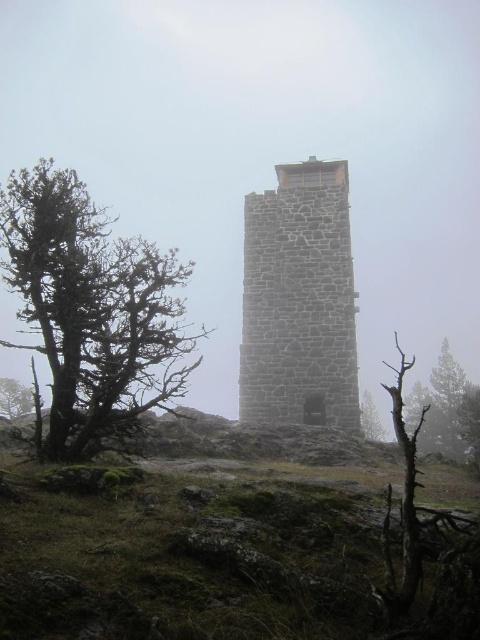
Locate an element on the screen. The height and width of the screenshot is (640, 480). stone tower at center is located at coordinates (300, 300).

Between point (264, 195) and point (15, 401), which one is positioned in front?

Positioned in front is point (264, 195).

Image resolution: width=480 pixels, height=640 pixels. I want to click on stone tower at center, so click(x=300, y=300).

Which is above, brown textured tree at lower right or green leafy tree at left?

brown textured tree at lower right

Is point (478, 400) farther from viewer compared to point (12, 401)?

No, (478, 400) is closer to viewer.

Is point (456, 401) closer to camera compared to point (20, 381)?

Yes.

Find the location of a particular element. Image resolution: width=480 pixels, height=640 pixels. brown textured tree at lower right is located at coordinates (446, 412).

Looking at this image, does green leafy tree at left appear under bare wood tree at center?

Incorrect, green leafy tree at left is not positioned below bare wood tree at center.

Is point (13, 403) positioned in front of point (360, 406)?

No, it is not.

Identify the location of green leafy tree at left. (14, 397).